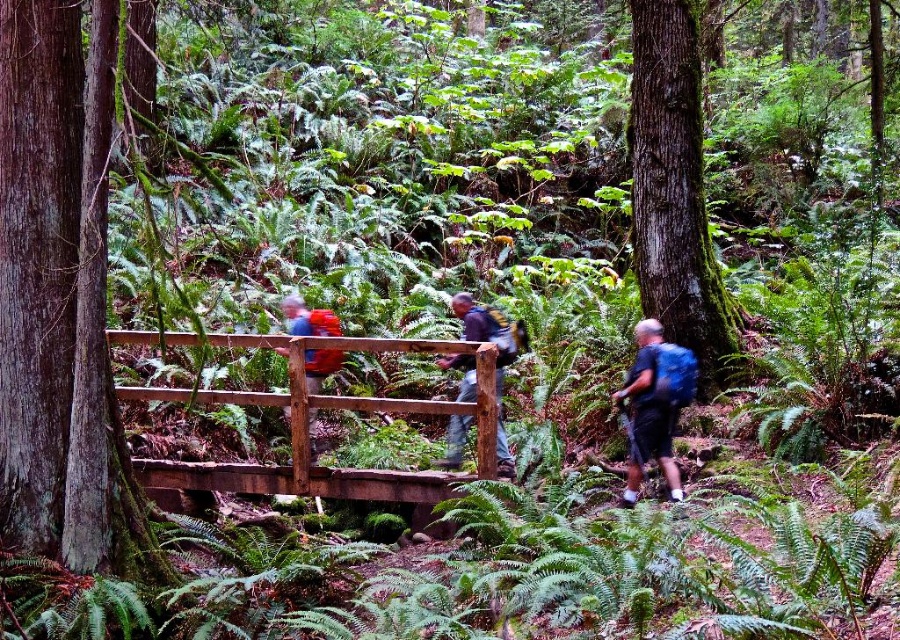
Is dark blue backpack at center thinner than matte red backpack at center?

Incorrect, dark blue backpack at center's width is not less than matte red backpack at center's.

Is point (500, 445) less distant than point (311, 412)?

Yes, it is.

Where is `dark blue backpack at center`? The height and width of the screenshot is (640, 900). dark blue backpack at center is located at coordinates (489, 330).

The width and height of the screenshot is (900, 640). What do you see at coordinates (675, 193) in the screenshot? I see `green mossy tree at right` at bounding box center [675, 193].

Does green mossy tree at right appear under brown wooden bridge at center?

No, green mossy tree at right is not below brown wooden bridge at center.

The height and width of the screenshot is (640, 900). Identify the location of green mossy tree at right. (675, 193).

Is blue backpack at right positioned behind matte red backpack at center?

That is False.

Does blue backpack at right have a smaller size compared to matte red backpack at center?

Correct, blue backpack at right occupies less space than matte red backpack at center.

Locate an element on the screen. blue backpack at right is located at coordinates (655, 404).